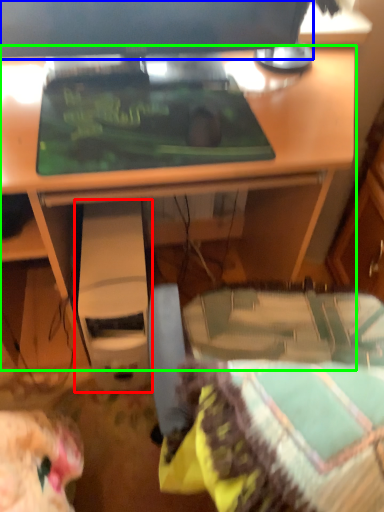
Question: Which object is the farthest from computer (highlighted by a red box)? Choose among these: computer monitor (highlighted by a blue box) or desk (highlighted by a green box).

Choices:
 (A) computer monitor
 (B) desk

Answer: (A)